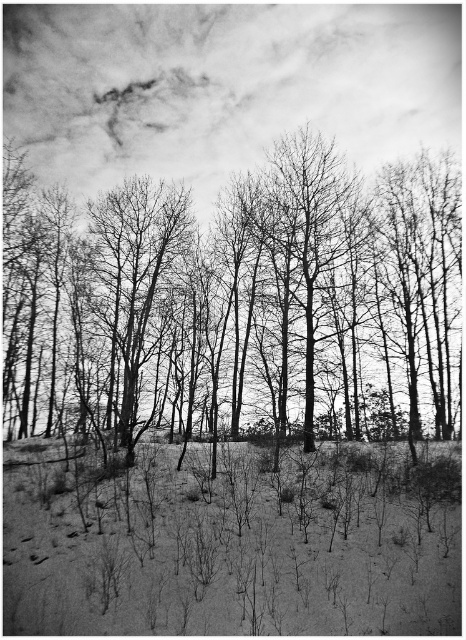
Question: Among these objects, which one is farthest from the camera?

Choices:
 (A) smooth bark trees at center
 (B) smooth bark tree at center

Answer: (B)

Question: Considering the relative positions of smooth bark trees at center and smooth bark tree at center in the image provided, where is smooth bark trees at center located with respect to smooth bark tree at center?

Choices:
 (A) right
 (B) left

Answer: (A)

Question: Observing the image, what is the correct spatial positioning of smooth bark trees at center in reference to smooth bark tree at center?

Choices:
 (A) above
 (B) below

Answer: (A)

Question: Can you confirm if smooth bark trees at center is positioned above smooth bark tree at center?

Choices:
 (A) yes
 (B) no

Answer: (A)